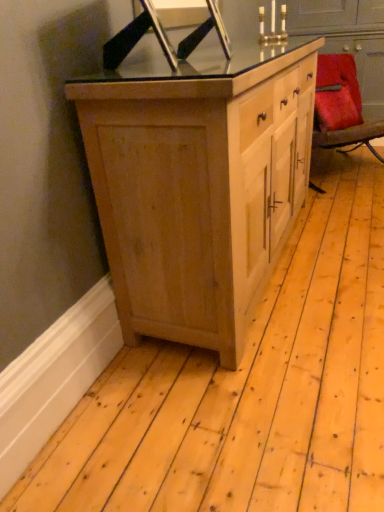
Question: Is velvet red chair at right smaller than natural wood cabinet at center?

Choices:
 (A) yes
 (B) no

Answer: (A)

Question: From a real-world perspective, is velvet red chair at right below natural wood cabinet at center?

Choices:
 (A) no
 (B) yes

Answer: (B)

Question: Can you confirm if velvet red chair at right is thinner than natural wood cabinet at center?

Choices:
 (A) no
 (B) yes

Answer: (B)

Question: Considering the relative positions of velvet red chair at right and natural wood cabinet at center in the image provided, is velvet red chair at right to the right of natural wood cabinet at center from the viewer's perspective?

Choices:
 (A) no
 (B) yes

Answer: (B)

Question: Is velvet red chair at right in contact with natural wood cabinet at center?

Choices:
 (A) yes
 (B) no

Answer: (B)

Question: Is velvet red chair at right further to camera compared to natural wood cabinet at center?

Choices:
 (A) yes
 (B) no

Answer: (A)

Question: Is natural wood cabinet at center to the right of velvet red chair at right from the viewer's perspective?

Choices:
 (A) no
 (B) yes

Answer: (A)

Question: Is the depth of natural wood cabinet at center less than that of velvet red chair at right?

Choices:
 (A) no
 (B) yes

Answer: (B)

Question: Is natural wood cabinet at center thinner than velvet red chair at right?

Choices:
 (A) yes
 (B) no

Answer: (B)

Question: Considering the relative sizes of natural wood cabinet at center and velvet red chair at right in the image provided, is natural wood cabinet at center bigger than velvet red chair at right?

Choices:
 (A) yes
 (B) no

Answer: (A)

Question: Is velvet red chair at right surrounded by natural wood cabinet at center?

Choices:
 (A) no
 (B) yes

Answer: (A)

Question: Is natural wood cabinet at center not near velvet red chair at right?

Choices:
 (A) yes
 (B) no

Answer: (A)

Question: Is metallic gold candle holder at upper center not within natural wood cabinet at center?

Choices:
 (A) no
 (B) yes

Answer: (B)